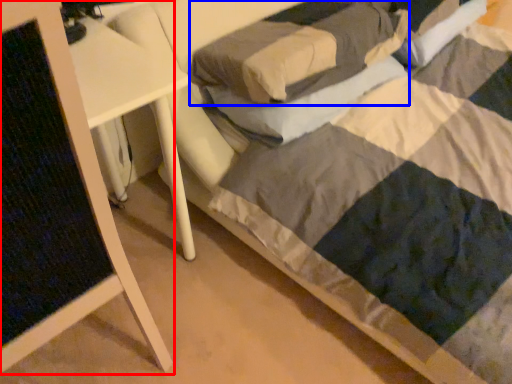
Question: Among these objects, which one is nearest to the camera, furniture (highlighted by a red box) or pillow (highlighted by a blue box)?

Choices:
 (A) furniture
 (B) pillow

Answer: (A)